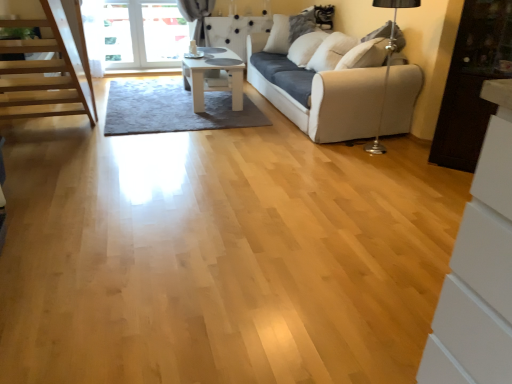
Question: Is white soft pillow at upper center positioned beyond the bounds of white fabric couch at center?

Choices:
 (A) no
 (B) yes

Answer: (A)

Question: Can you confirm if white soft pillow at upper center is smaller than white fabric couch at center?

Choices:
 (A) no
 (B) yes

Answer: (B)

Question: From a real-world perspective, does white soft pillow at upper center stand above white fabric couch at center?

Choices:
 (A) yes
 (B) no

Answer: (A)

Question: Is white soft pillow at upper center at the right side of white fabric couch at center?

Choices:
 (A) no
 (B) yes

Answer: (A)

Question: Is white soft pillow at upper center aimed at white fabric couch at center?

Choices:
 (A) yes
 (B) no

Answer: (A)

Question: From the image's perspective, relative to dark wood cabinet at right, is white glossy table at center above or below?

Choices:
 (A) above
 (B) below

Answer: (A)

Question: In terms of height, does white glossy table at center look taller or shorter compared to dark wood cabinet at right?

Choices:
 (A) short
 (B) tall

Answer: (A)

Question: Considering the relative positions of white glossy table at center and dark wood cabinet at right in the image provided, is white glossy table at center to the left or to the right of dark wood cabinet at right?

Choices:
 (A) right
 (B) left

Answer: (B)

Question: Is point (230, 74) positioned closer to the camera than point (445, 97)?

Choices:
 (A) closer
 (B) farther

Answer: (B)

Question: Would you say white glossy table at center is inside or outside white fabric couch at center?

Choices:
 (A) outside
 (B) inside

Answer: (A)

Question: Would you say white glossy table at center is to the left or to the right of white fabric couch at center in the picture?

Choices:
 (A) right
 (B) left

Answer: (B)

Question: In terms of width, does white glossy table at center look wider or thinner when compared to white fabric couch at center?

Choices:
 (A) wide
 (B) thin

Answer: (B)

Question: In the image, is white glossy table at center positioned in front of or behind white fabric couch at center?

Choices:
 (A) front
 (B) behind

Answer: (B)

Question: From the image's perspective, is white glossy table at center above or below white soft pillow at upper center?

Choices:
 (A) above
 (B) below

Answer: (B)

Question: Is white glossy table at center situated inside white soft pillow at upper center or outside?

Choices:
 (A) outside
 (B) inside

Answer: (A)